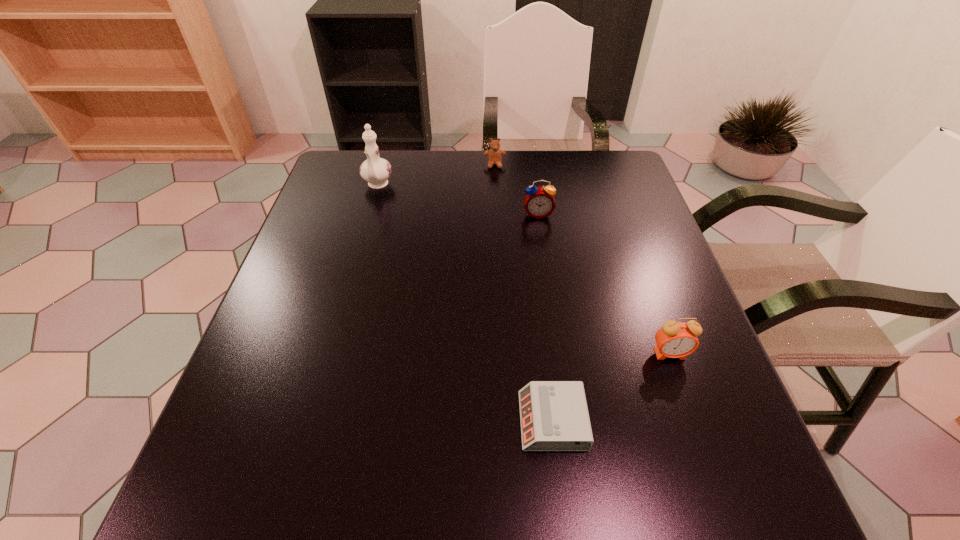
Locate an element on the screen. free point that satisfies the following two spatial constraints: 1. on the face of the shortest alarm clock; 2. on the right side of the farthest object is located at coordinates (506, 421).